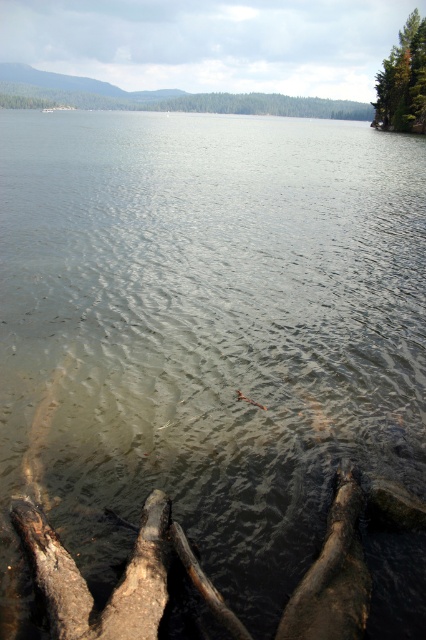
Which is more to the left, dark brown rough wood at lower left or green matte tree at upper right?

From the viewer's perspective, dark brown rough wood at lower left appears more on the left side.

Can you confirm if dark brown rough wood at lower left is shorter than green matte tree at upper right?

Yes, dark brown rough wood at lower left is shorter than green matte tree at upper right.

Is point (72, 576) behind point (423, 58)?

No, (72, 576) is closer to viewer.

Where is `dark brown rough wood at lower left`? The image size is (426, 640). dark brown rough wood at lower left is located at coordinates (86, 582).

Is dark brown rough wood at lower left positioned in front of dark brown wood log at lower center?

Yes, it is.

Does dark brown rough wood at lower left appear under dark brown wood log at lower center?

No, dark brown rough wood at lower left is not below dark brown wood log at lower center.

Locate an element on the screen. The width and height of the screenshot is (426, 640). dark brown rough wood at lower left is located at coordinates (86, 582).

In order to click on dark brown rough wood at lower left in this screenshot , I will do `click(86, 582)`.

In the scene shown: Does dark brown wood log at lower center have a larger size compared to green matte tree at upper right?

No.

Which is below, dark brown wood log at lower center or green matte tree at upper right?

dark brown wood log at lower center is lower down.

Where is `dark brown wood log at lower center`? The height and width of the screenshot is (640, 426). dark brown wood log at lower center is located at coordinates 333,576.